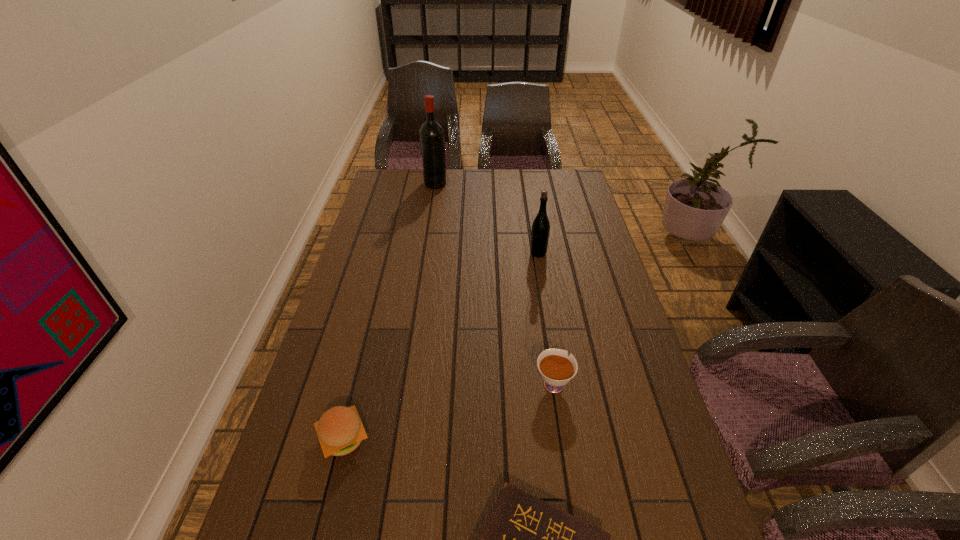
Where is `the farthest object`? The width and height of the screenshot is (960, 540). the farthest object is located at coordinates (432, 140).

Image resolution: width=960 pixels, height=540 pixels. What are the coordinates of `the tallest object` in the screenshot? It's located at (432, 140).

The height and width of the screenshot is (540, 960). Identify the location of the fourth nearest object. (540, 230).

This screenshot has width=960, height=540. What are the coordinates of `the second tallest object` in the screenshot? It's located at (540, 230).

This screenshot has width=960, height=540. In order to click on teacup in this screenshot , I will do `click(556, 368)`.

The height and width of the screenshot is (540, 960). I want to click on the fourth farthest object, so click(x=340, y=431).

The height and width of the screenshot is (540, 960). In order to click on the leftmost object in this screenshot , I will do `click(340, 431)`.

Locate an element on the screen. vacant space located on the front of the farthest object is located at coordinates (433, 202).

Locate an element on the screen. The height and width of the screenshot is (540, 960). free space located on the right of the second farthest object is located at coordinates (581, 253).

Identify the location of free space located on the side of the third nearest object with the handle. tap(547, 342).